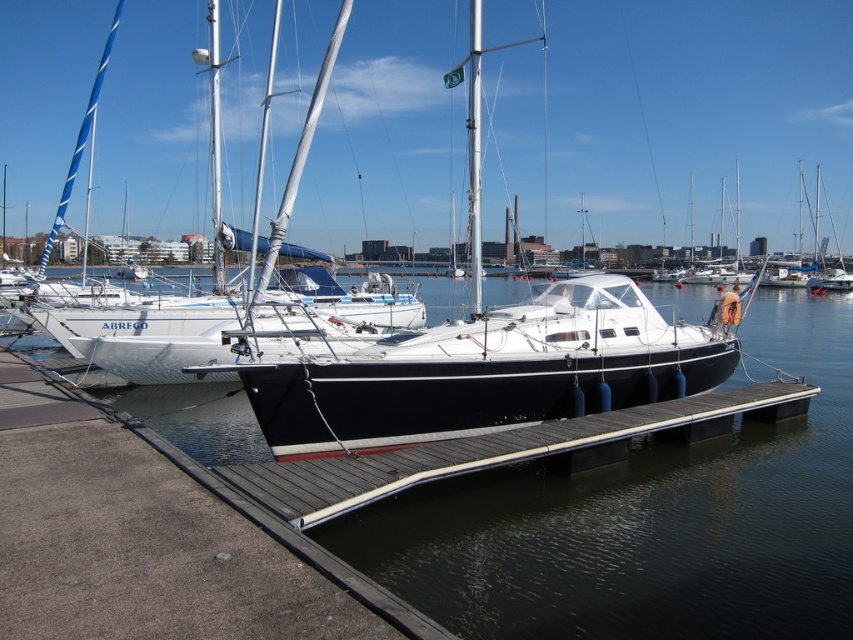
Question: Can you confirm if transparent water at center is positioned above white glossy sailboat at center?

Choices:
 (A) yes
 (B) no

Answer: (A)

Question: Which point is farther to the camera?

Choices:
 (A) smooth wood dock at center
 (B) white glossy sailboat at center

Answer: (B)

Question: Which point is farther to the camera?

Choices:
 (A) transparent water at center
 (B) smooth wood dock at center

Answer: (B)

Question: Which point is closer to the camera taking this photo?

Choices:
 (A) (234, 406)
 (B) (337, 477)

Answer: (B)

Question: Is transparent water at center positioned in front of white glossy sailboat at center?

Choices:
 (A) yes
 (B) no

Answer: (A)

Question: Does white glossy sailboat at center lie in front of smooth wood dock at center?

Choices:
 (A) yes
 (B) no

Answer: (B)